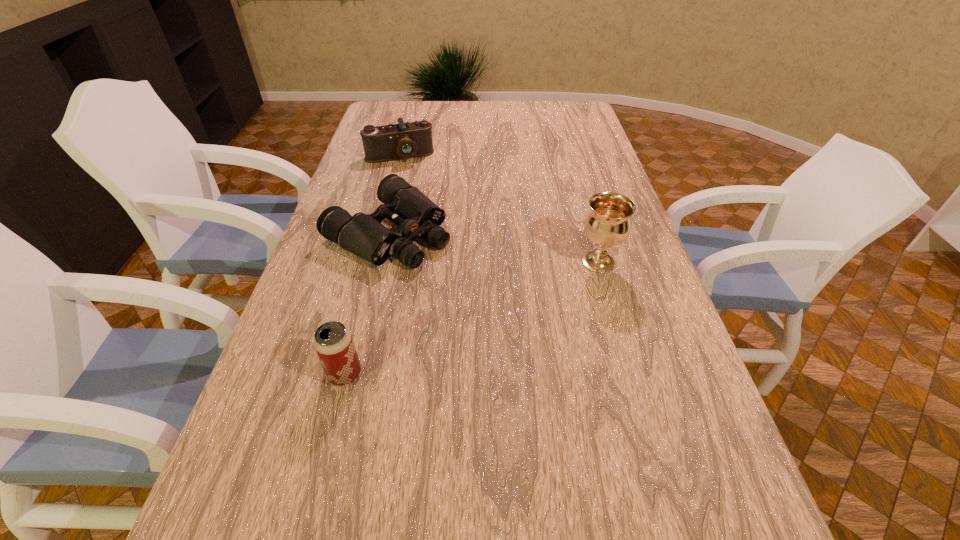
Identify the location of vacant spot on the desktop that is between the nearest object and the chalice and is positioned through the eyepieces of the shortest object. The image size is (960, 540). (512, 301).

The image size is (960, 540). In order to click on free space on the desktop that is between the beer can and the rightmost object and is positioned on the lens of the camera in this screenshot , I will do `click(453, 327)`.